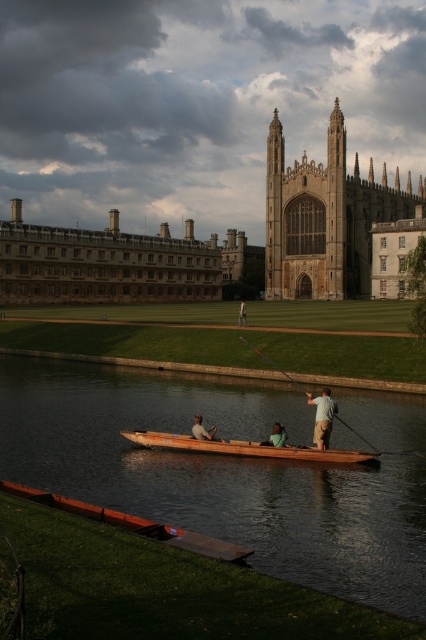
Question: Can you confirm if light brown cotton shirt at center is wider than light blue jeans at center?

Choices:
 (A) yes
 (B) no

Answer: (A)

Question: Which object appears farthest from the camera in this image?

Choices:
 (A) light brown cotton shirt at center
 (B) green fabric shirt at center
 (C) wooden smooth paddle at center

Answer: (B)

Question: Does stone gothic cathedral at center have a greater width compared to green fabric shirt at center?

Choices:
 (A) no
 (B) yes

Answer: (B)

Question: Does light brown cotton shirt at center appear under wooden smooth paddle at center?

Choices:
 (A) yes
 (B) no

Answer: (A)

Question: Which is nearer to the wooden canoe at center?

Choices:
 (A) wooden smooth paddle at center
 (B) light brown wooden paddle boat at center
 (C) stone gothic cathedral at center

Answer: (B)

Question: Among these points, which one is farthest from the camera?

Choices:
 (A) (241, 300)
 (B) (282, 445)
 (C) (293, 554)
 (D) (184, 436)

Answer: (A)